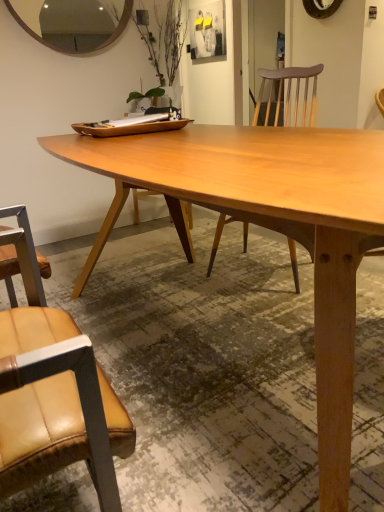
Question: Is wooden mirror at upper left at the back of leather at left?

Choices:
 (A) no
 (B) yes

Answer: (A)

Question: Could you tell me if leather at left is turned towards wooden mirror at upper left?

Choices:
 (A) no
 (B) yes

Answer: (A)

Question: Is leather at left surrounding wooden mirror at upper left?

Choices:
 (A) yes
 (B) no

Answer: (B)

Question: Is leather at left further to the viewer compared to wooden mirror at upper left?

Choices:
 (A) no
 (B) yes

Answer: (A)

Question: From a real-world perspective, is leather at left under wooden mirror at upper left?

Choices:
 (A) yes
 (B) no

Answer: (A)

Question: Considering the relative positions of leather at left and wooden mirror at upper left in the image provided, is leather at left to the right of wooden mirror at upper left from the viewer's perspective?

Choices:
 (A) no
 (B) yes

Answer: (B)

Question: Does leather at left have a greater height compared to light brown wood table at center?

Choices:
 (A) no
 (B) yes

Answer: (B)

Question: From the image's perspective, is leather at left on light brown wood table at center?

Choices:
 (A) yes
 (B) no

Answer: (B)

Question: Could you tell me if leather at left is turned towards light brown wood table at center?

Choices:
 (A) yes
 (B) no

Answer: (A)

Question: Can you confirm if leather at left is bigger than light brown wood table at center?

Choices:
 (A) no
 (B) yes

Answer: (A)

Question: Is leather at left at the left side of light brown wood table at center?

Choices:
 (A) yes
 (B) no

Answer: (A)

Question: Is leather at left not close to light brown wood table at center?

Choices:
 (A) yes
 (B) no

Answer: (B)

Question: Is light brown wood table at center wider than wooden mirror at upper left?

Choices:
 (A) no
 (B) yes

Answer: (B)